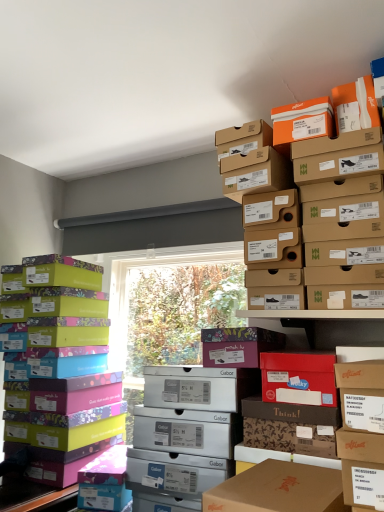
Question: Is cardboard shoebox at upper center inside or outside of multicolored cardboard shoebox at left?

Choices:
 (A) outside
 (B) inside

Answer: (A)

Question: Is point (233, 157) closer or farther from the camera than point (119, 418)?

Choices:
 (A) closer
 (B) farther

Answer: (A)

Question: Estimate the real-world distances between objects in this image. Which object is farther from the cardboard shoebox at upper center?

Choices:
 (A) matte purple shoebox at center
 (B) multicolored cardboard shoebox at left

Answer: (B)

Question: Based on their relative distances, which object is farther from the matte purple shoebox at center?

Choices:
 (A) cardboard shoebox at upper center
 (B) multicolored cardboard shoebox at left

Answer: (B)